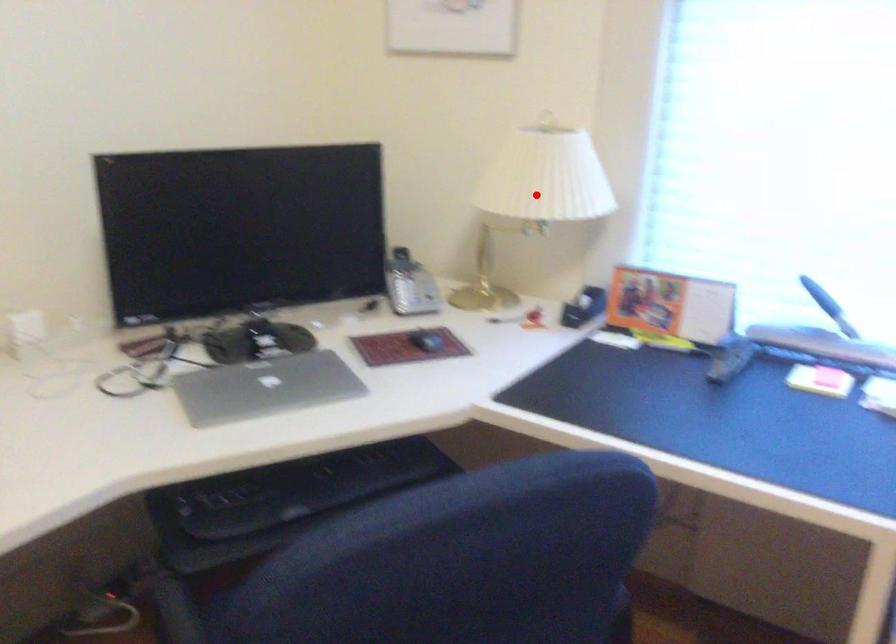
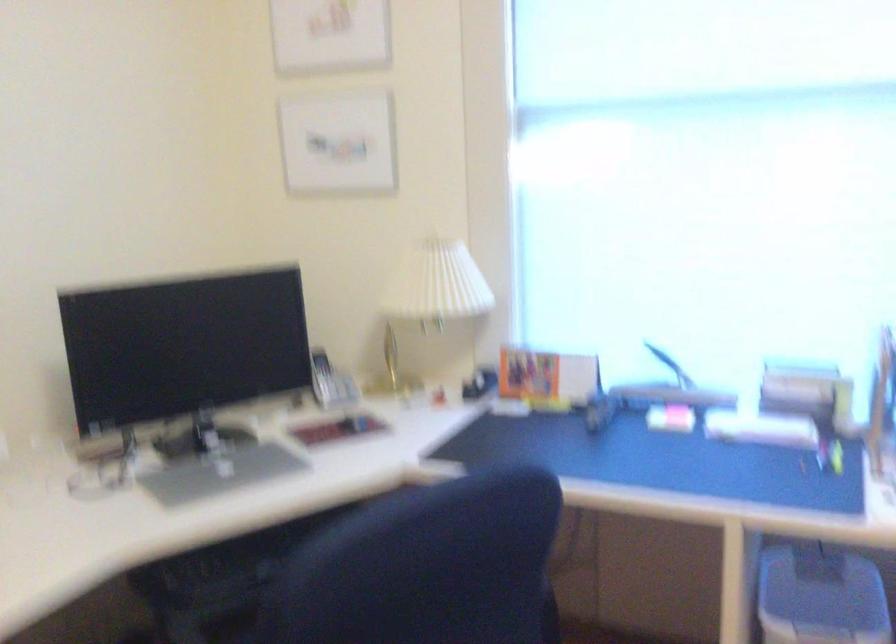
Question: I am providing you with two images of the same scene from different viewpoints. In image1, a red point is highlighted. Considering the same 3D point in image2, which of the following is correct?

Choices:
 (A) It is closer
 (B) It is farther

Answer: (B)